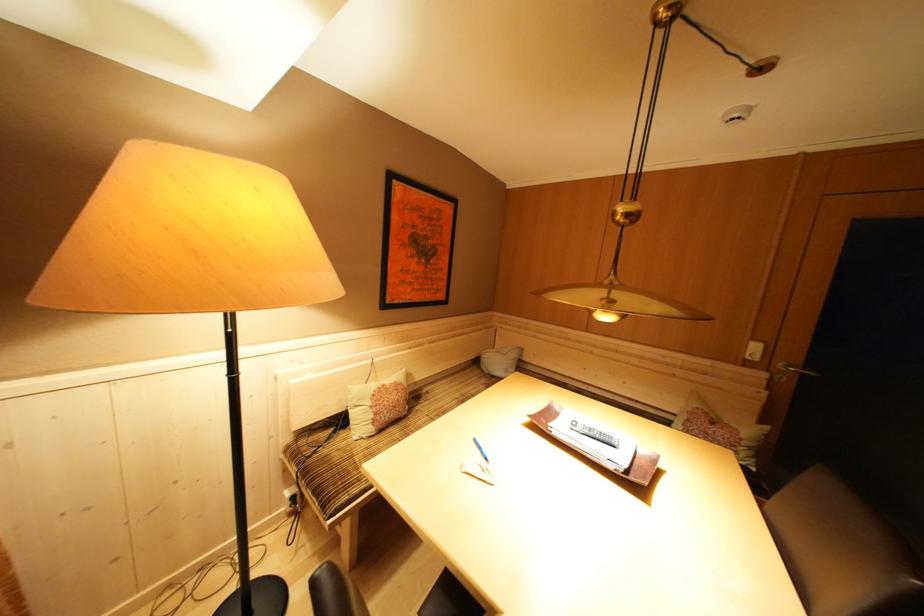
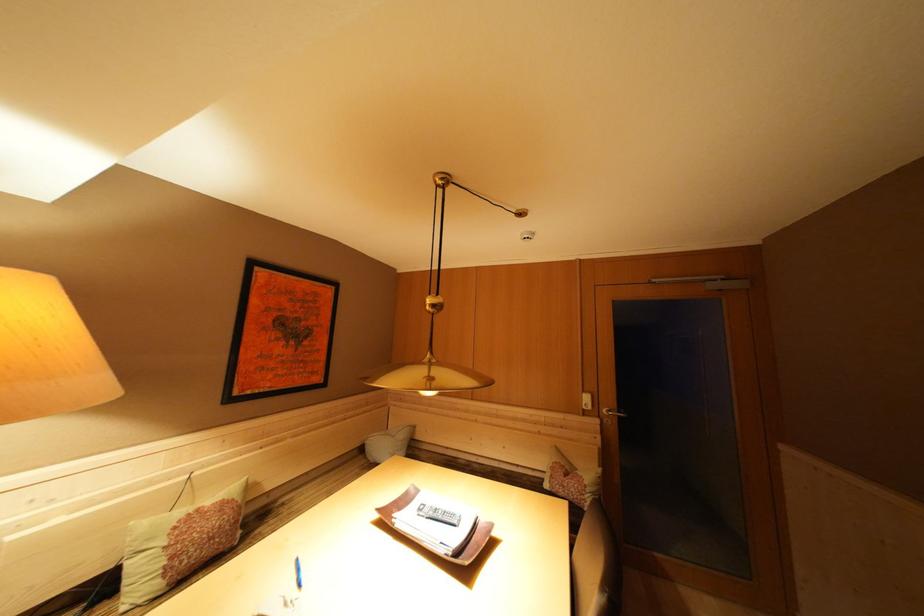
The point at (390,391) is marked in the first image. Where is the corresponding point in the second image?

(204, 515)